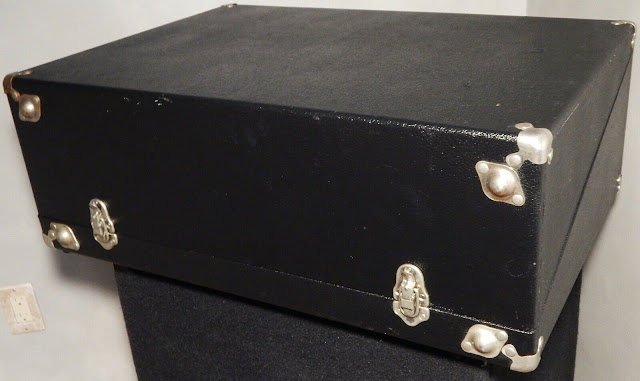
The width and height of the screenshot is (640, 381). Identify the location of right latch. click(406, 304).